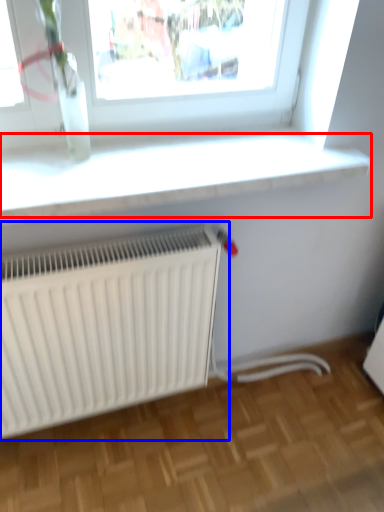
Question: Which object is further to the camera taking this photo, window sill (highlighted by a red box) or radiator (highlighted by a blue box)?

Choices:
 (A) window sill
 (B) radiator

Answer: (B)